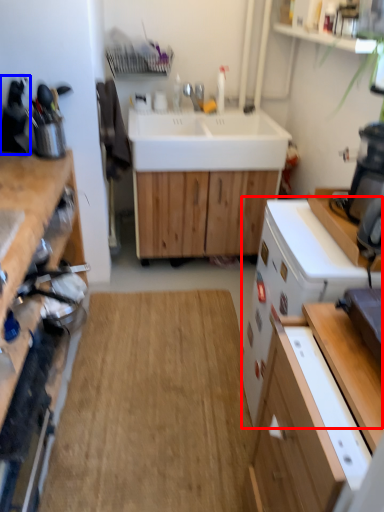
Question: Which point is closer to the camera, dish washer (highlighted by a red box) or appliance (highlighted by a blue box)?

Choices:
 (A) dish washer
 (B) appliance

Answer: (A)